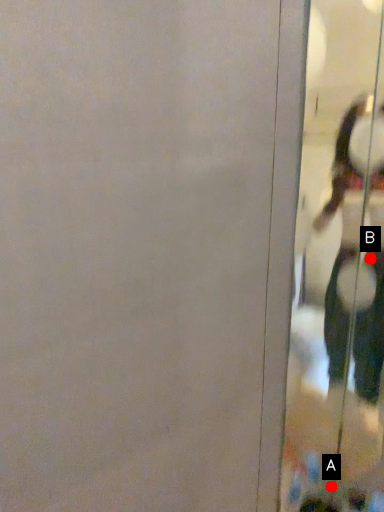
Question: Two points are circled on the image, labeled by A and B beside each circle. Which point is farther to the camera?

Choices:
 (A) A is further
 (B) B is further

Answer: (A)